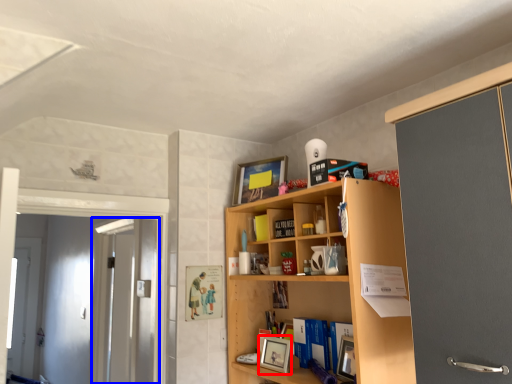
Question: Among these objects, which one is nearest to the camera, picture frame (highlighted by a red box) or screen door (highlighted by a blue box)?

Choices:
 (A) picture frame
 (B) screen door

Answer: (A)